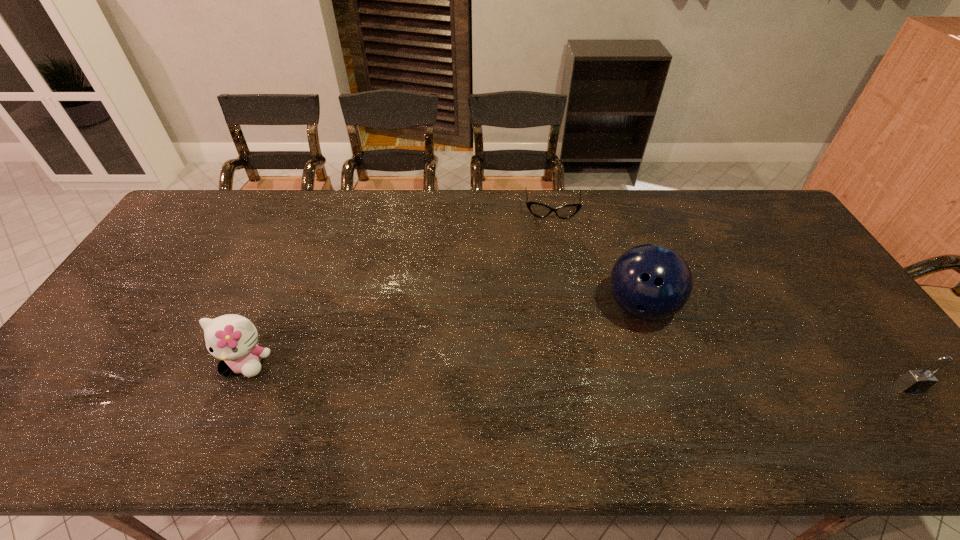
Locate an element on the screen. Image resolution: width=960 pixels, height=540 pixels. the second tallest object is located at coordinates (232, 338).

You are a GUI agent. You are given a task and a screenshot of the screen. Output one action in this format:
    pyautogui.click(x=<x>, y=<y>)
    Task: Click on the kitten
    The width and height of the screenshot is (960, 540).
    Given the screenshot: What is the action you would take?
    pyautogui.click(x=232, y=338)

Identify the location of the rightmost object. (914, 381).

At what (x,y) coordinates should I click in order to perform the action: click on the third tallest object. Please return your answer as a coordinate pair (x, y). This screenshot has width=960, height=540. Looking at the image, I should click on (914, 381).

Where is `the tallest object`? Image resolution: width=960 pixels, height=540 pixels. the tallest object is located at coordinates point(651,282).

The image size is (960, 540). Identify the location of the third nearest object. (651, 282).

Find the location of a particular element. spectacles is located at coordinates (539, 210).

At what (x,y) coordinates should I click in order to perform the action: click on the farthest object. Please return your answer as a coordinate pair (x, y). Looking at the image, I should click on (539, 210).

Locate an element on the screen. Image resolution: width=960 pixels, height=540 pixels. free space located on the front-facing side of the leftmost object is located at coordinates (230, 400).

Where is `free region located on the surface of the second farthest object near the finger holes`? This screenshot has width=960, height=540. free region located on the surface of the second farthest object near the finger holes is located at coordinates (645, 352).